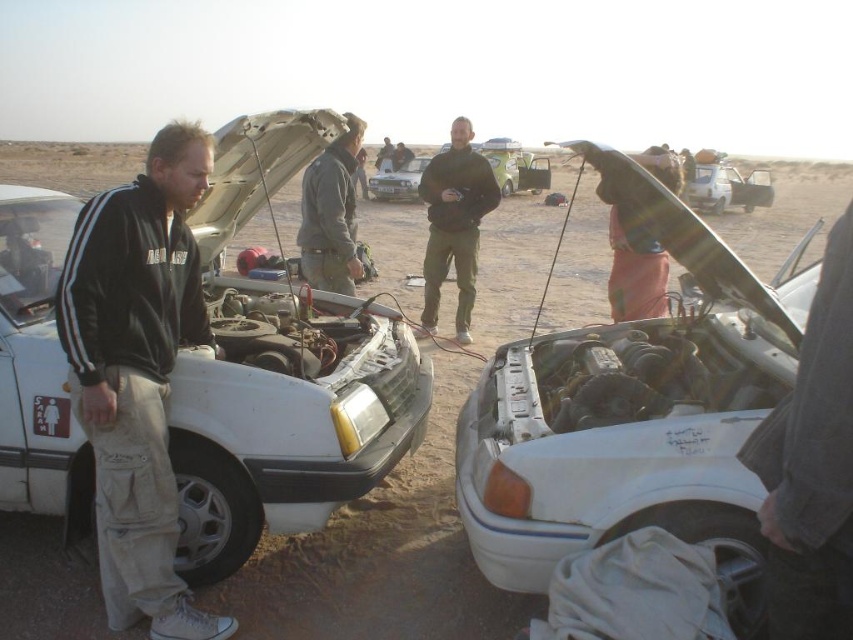
Question: Which object appears closest to the camera in this image?

Choices:
 (A) white matte car at center
 (B) metallic silver car at center
 (C) black matte jacket at center

Answer: (A)

Question: Is white matte car at left below dark gray jacket at center?

Choices:
 (A) no
 (B) yes

Answer: (B)

Question: Is dark gray jacket at center further to the viewer compared to matte silver sedan at center?

Choices:
 (A) yes
 (B) no

Answer: (B)

Question: Which point is farther to the camera?

Choices:
 (A) white matte car at center
 (B) black cotton jacket at left
 (C) metallic silver car at center
 (D) matte silver sedan at center

Answer: (D)

Question: Among these objects, which one is nearest to the camera?

Choices:
 (A) black matte jacket at center
 (B) black cotton jacket at left
 (C) metallic silver car at center
 (D) matte silver sedan at center

Answer: (B)

Question: Observing the image, what is the correct spatial positioning of dark gray jacket at center in reference to metallic silver car at center?

Choices:
 (A) below
 (B) above

Answer: (A)